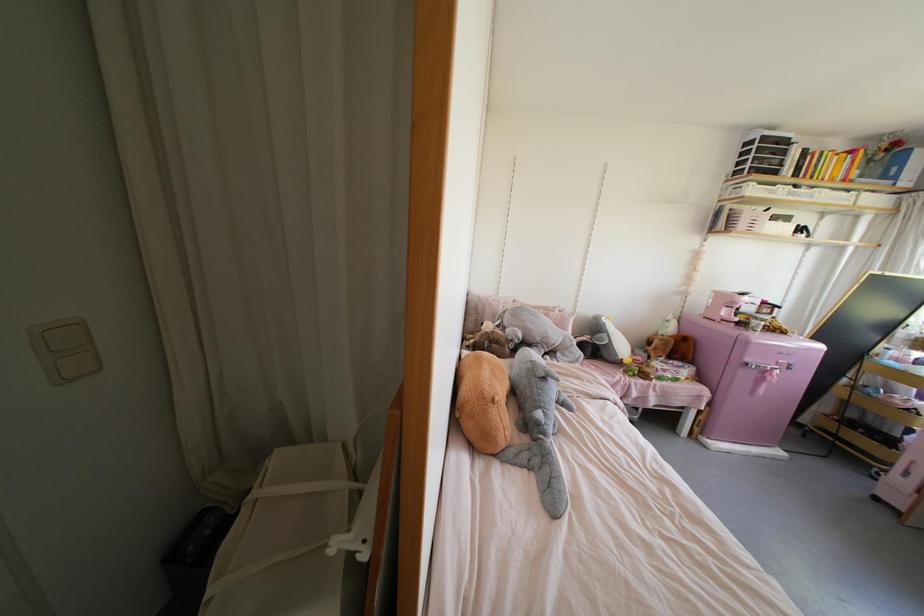
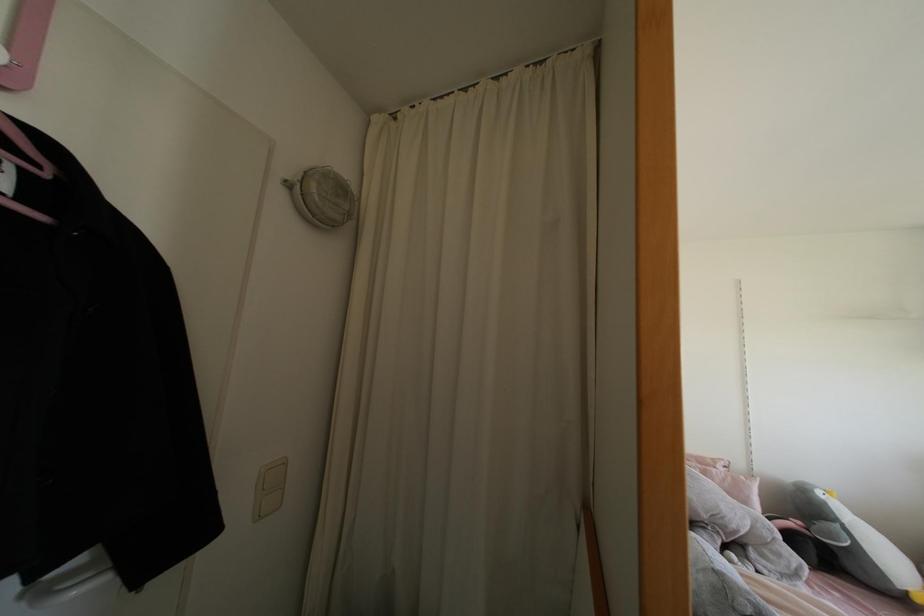
Find the pixel in the second image that matches the point at 553,307 in the first image.

(712, 460)